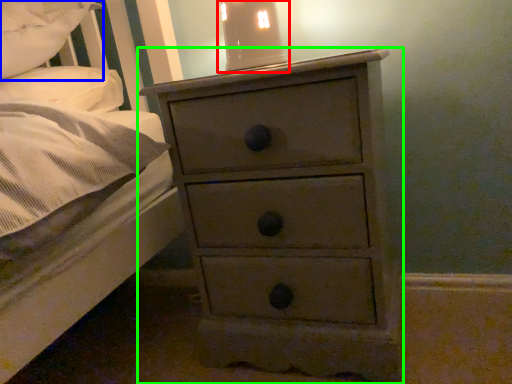
Question: Which object is positioned farthest from bedside lamp (highlighted by a red box)? Select from pillow (highlighted by a blue box) and chest of drawers (highlighted by a green box).

Choices:
 (A) pillow
 (B) chest of drawers

Answer: (A)